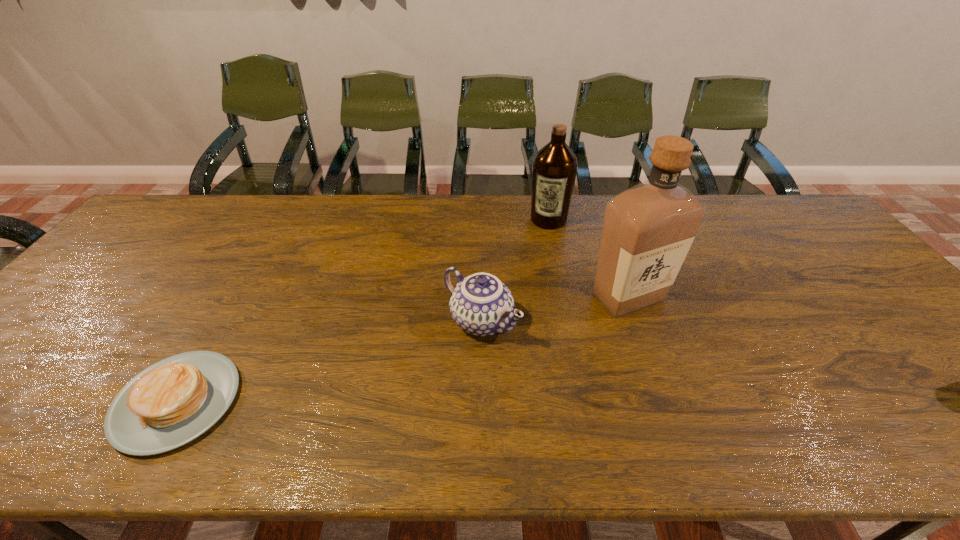
Where is `pancake`? pancake is located at coordinates (174, 401).

Locate an element on the screen. the shortest object is located at coordinates (174, 401).

Image resolution: width=960 pixels, height=540 pixels. I want to click on the tallest object, so click(647, 230).

At what (x,y) coordinates should I click in order to perform the action: click on the third tallest object. Please return your answer as a coordinate pair (x, y). The image size is (960, 540). Looking at the image, I should click on (481, 304).

Locate an element on the screen. the second object from left to right is located at coordinates (481, 304).

Identify the location of the farthest object. (554, 169).

Locate an element on the screen. the third shortest object is located at coordinates (554, 169).

The image size is (960, 540). I want to click on vacant space located 0.320m on the back of the pancake, so click(x=255, y=267).

Identify the location of free spot located on the front-facing side of the tallest object. (640, 389).

Find the location of a particular element. Image resolution: width=960 pixels, height=540 pixels. vacant area located on the front-facing side of the tallest object is located at coordinates (634, 340).